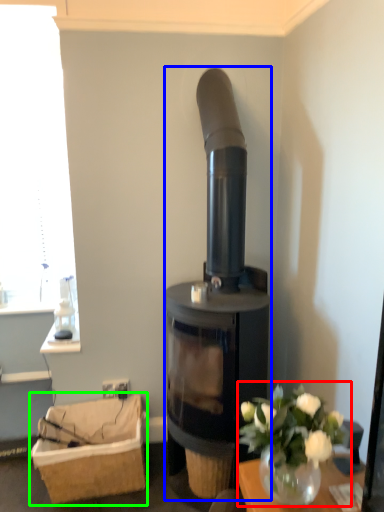
Question: Which is farther away from floral arrangement (highlighted by a red box)? wood burning stove (highlighted by a blue box) or basket (highlighted by a green box)?

Choices:
 (A) wood burning stove
 (B) basket

Answer: (B)